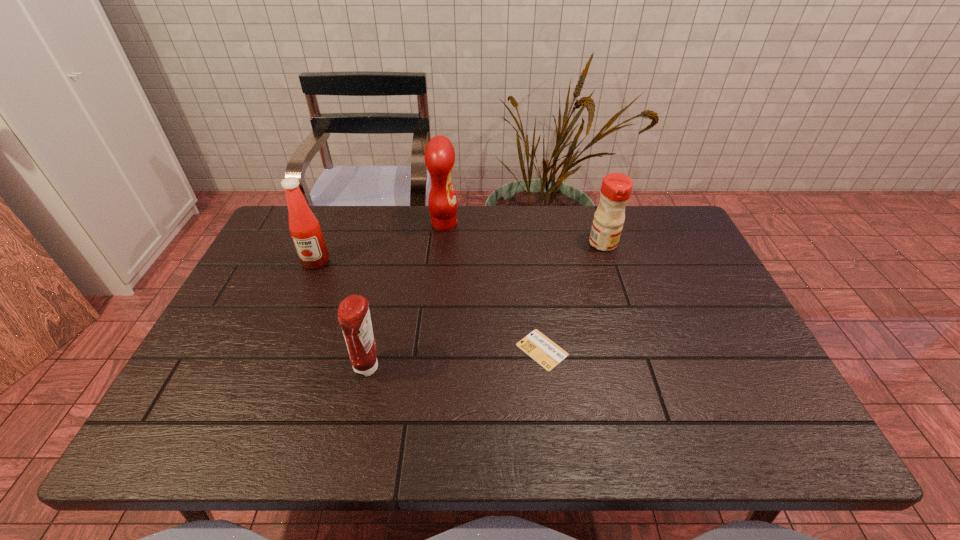
Locate an element on the screen. blank space that satisfies the following two spatial constraints: 1. on the label side of the third object from left to right; 2. on the front-facing side of the leftmost object is located at coordinates (441, 262).

Identify the location of vacant space that satisfies the following two spatial constraints: 1. on the back side of the rightmost object; 2. on the label side of the third object from right to left. (597, 224).

You are a GUI agent. You are given a task and a screenshot of the screen. Output one action in this format:
    pyautogui.click(x=<x>, y=<y>)
    Task: Click on the vacant region that satisfies the following two spatial constraints: 1. on the label side of the second condiment from right to left; 2. on the back side of the rightmost object
    This screenshot has height=540, width=960.
    Given the screenshot: What is the action you would take?
    pyautogui.click(x=443, y=244)

The width and height of the screenshot is (960, 540). I want to click on vacant point that satisfies the following two spatial constraints: 1. on the label side of the third object from right to left; 2. on the left side of the second object from right to left, so click(x=432, y=350).

Locate an element on the screen. vacant region that satisfies the following two spatial constraints: 1. on the back side of the rightmost condiment; 2. on the label side of the third object from left to right is located at coordinates (597, 224).

The image size is (960, 540). Identify the location of free space that satisfies the following two spatial constraints: 1. on the front-facing side of the second object from right to left; 2. on the left side of the second nearest condiment. (279, 350).

This screenshot has height=540, width=960. Find the location of `vacant region that satisfies the following two spatial constraints: 1. on the label side of the third object from left to right; 2. on the right side of the second object from right to left`. vacant region that satisfies the following two spatial constraints: 1. on the label side of the third object from left to right; 2. on the right side of the second object from right to left is located at coordinates (432, 350).

At what (x,y) coordinates should I click in order to perform the action: click on free location that satisfies the following two spatial constraints: 1. on the front-facing side of the leftmost condiment; 2. on the left side of the second condiment from left to right. Please return your answer as a coordinate pair (x, y). The image size is (960, 540). Looking at the image, I should click on (272, 368).

Locate an element on the screen. The image size is (960, 540). vacant space that satisfies the following two spatial constraints: 1. on the back side of the identity card; 2. on the right side of the fourth object from right to left is located at coordinates tap(372, 350).